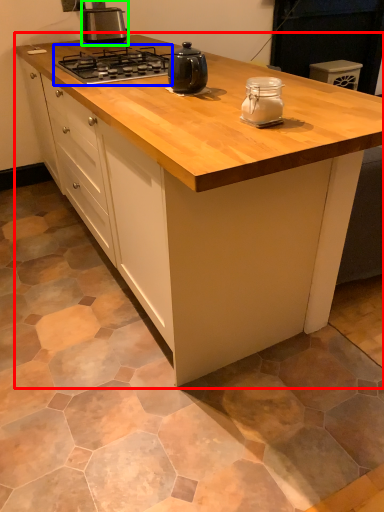
Question: Considering the real-world distances, which object is closest to cabinetry (highlighted by a red box)? gas stove (highlighted by a blue box) or kitchen appliance (highlighted by a green box).

Choices:
 (A) gas stove
 (B) kitchen appliance

Answer: (A)